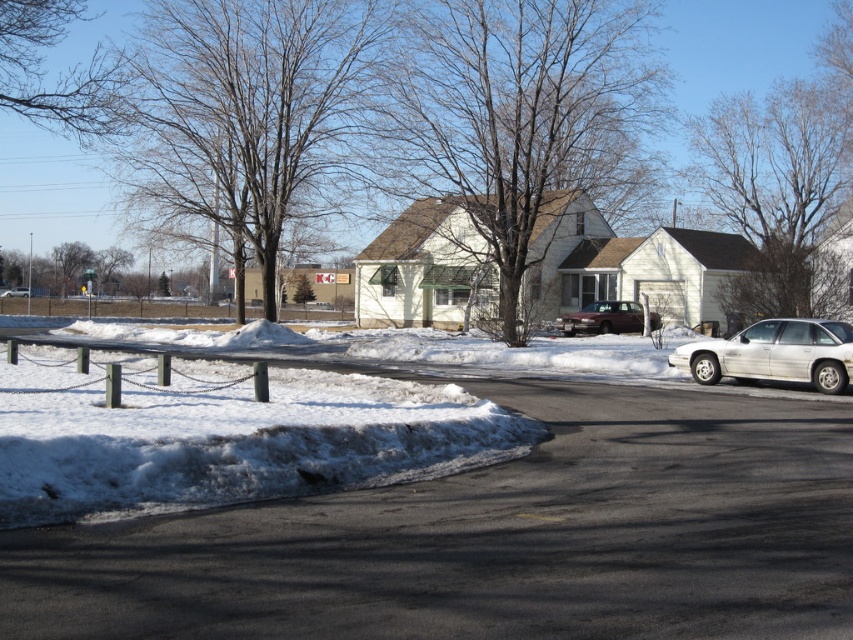
Question: Which of the following is the farthest from the observer?

Choices:
 (A) (282, 81)
 (B) (462, 61)
 (C) (659, 321)

Answer: (C)

Question: Does bare branches at center lie in front of bare branches at upper right?

Choices:
 (A) yes
 (B) no

Answer: (B)

Question: Among these objects, which one is farthest from the camera?

Choices:
 (A) bare branches at center
 (B) bare branches at upper right
 (C) brown/dry bark tree at center

Answer: (A)

Question: Which point appears farthest from the camera in this image?

Choices:
 (A) (21, 296)
 (B) (799, 225)
 (C) (619, 324)
 (D) (506, 122)

Answer: (A)

Question: Can you confirm if bare branches at center is thinner than bare branches at upper right?

Choices:
 (A) yes
 (B) no

Answer: (B)

Question: Can you confirm if brown/dry bark tree at center is positioned above matte black car at center?

Choices:
 (A) yes
 (B) no

Answer: (A)